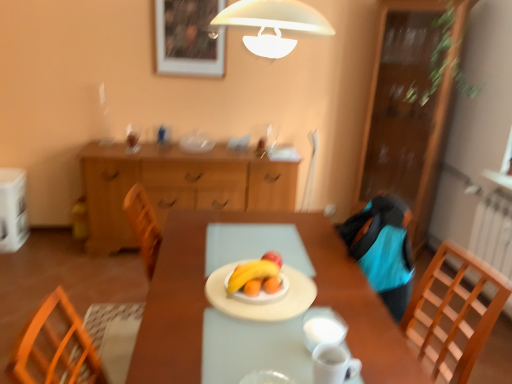
The image size is (512, 384). I want to click on vacant space to the right of white glossy mug at center, which is counted as the second tableware, starting from the back, so click(x=362, y=338).